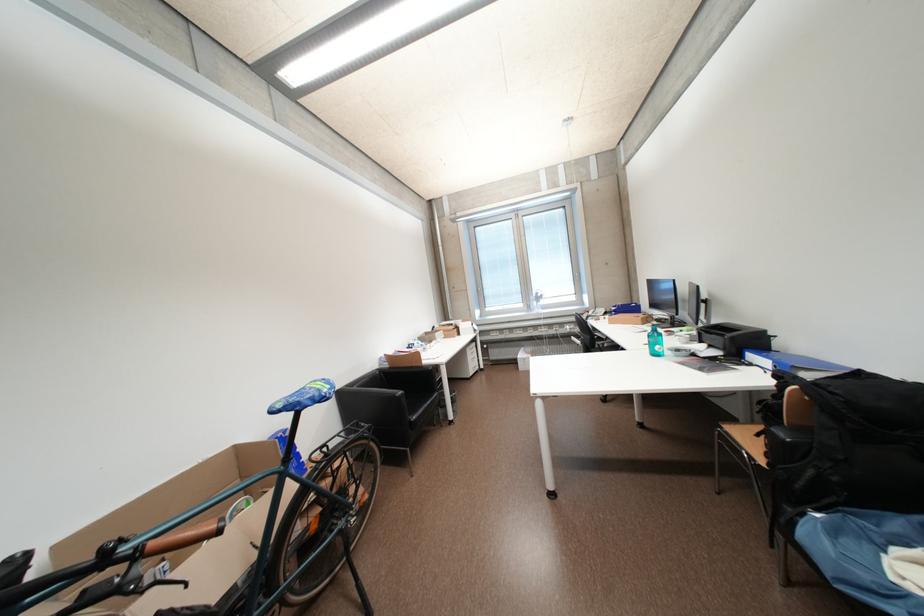
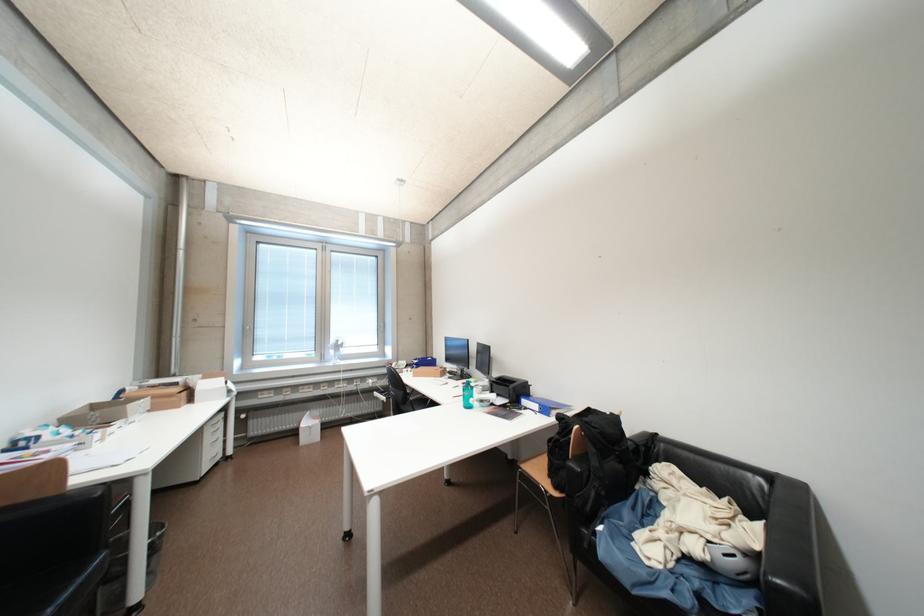
In the second image, find the point that corresponds to the point at 759,367 in the first image.

(533, 411)